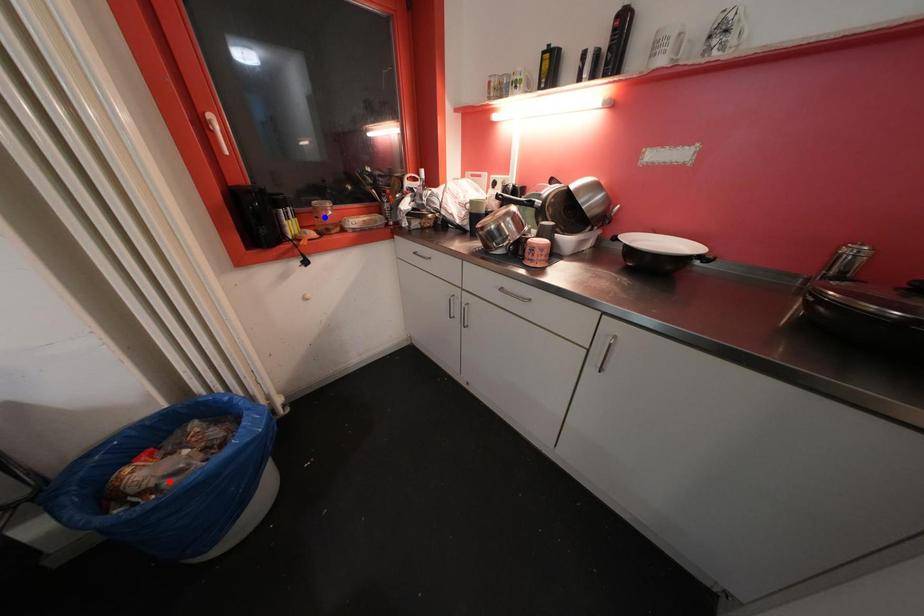
Question: Which of the two points in the image is closer to the camera?

Choices:
 (A) Blue point is closer.
 (B) Red point is closer.

Answer: (B)